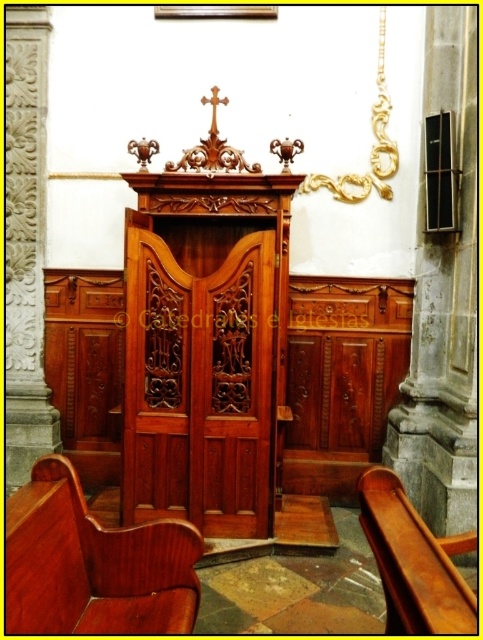
Question: Among these objects, which one is farthest from the camera?

Choices:
 (A) wooden polished chair at lower right
 (B) polished wood door at center

Answer: (B)

Question: Can you confirm if polished wood door at center is positioned to the left of mahogany wood bench at lower left?

Choices:
 (A) no
 (B) yes

Answer: (A)

Question: Estimate the real-world distances between objects in this image. Which object is closer to the wooden polished chair at lower right?

Choices:
 (A) mahogany wood bench at lower left
 (B) polished wood door at center

Answer: (A)

Question: In this image, where is mahogany wood bench at lower left located relative to wooden polished chair at lower right?

Choices:
 (A) above
 (B) below

Answer: (B)

Question: Is polished wood door at center closer to the viewer compared to mahogany wood bench at lower left?

Choices:
 (A) yes
 (B) no

Answer: (B)

Question: Which object is the closest to the mahogany wood bench at lower left?

Choices:
 (A) wooden polished chair at lower right
 (B) polished wood door at center

Answer: (A)